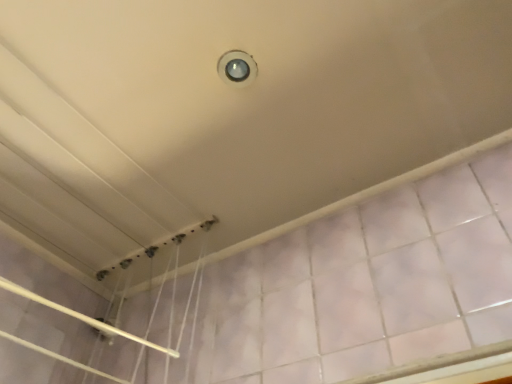
Find the location of `transparent plastic hole at center`. transparent plastic hole at center is located at coordinates (237, 68).

Image resolution: width=512 pixels, height=384 pixels. What do you see at coordinates (237, 68) in the screenshot?
I see `transparent plastic hole at center` at bounding box center [237, 68].

What is the approximate height of transparent plastic hole at center?

0.39 inches.

Identify the location of transparent plastic hole at center. The width and height of the screenshot is (512, 384). (237, 68).